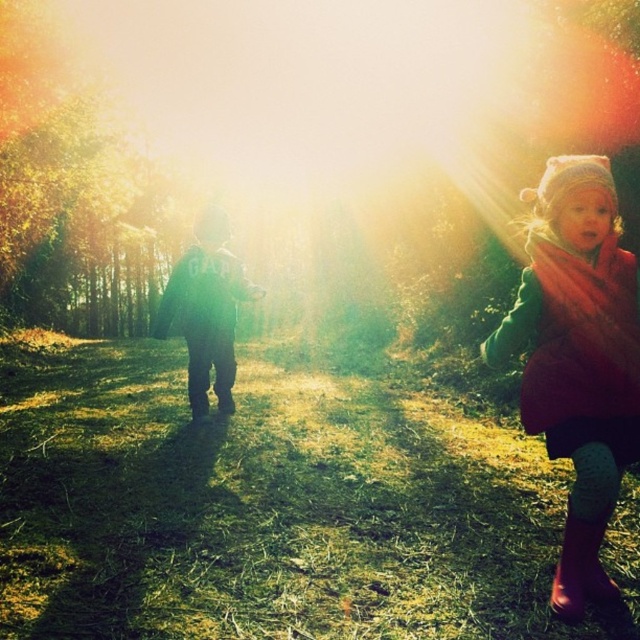
Can you confirm if knitted woolen hat at upper right is thinner than rubber boots at lower right?

No.

You are a GUI agent. You are given a task and a screenshot of the screen. Output one action in this format:
    pyautogui.click(x=<x>, y=<y>)
    Task: Click on the knitted woolen hat at upper right
    The width and height of the screenshot is (640, 640).
    Given the screenshot: What is the action you would take?
    pyautogui.click(x=577, y=356)

The width and height of the screenshot is (640, 640). What are the coordinates of `knitted woolen hat at upper right` in the screenshot? It's located at (577, 356).

Where is `knitted woolen hat at upper right`? The image size is (640, 640). knitted woolen hat at upper right is located at coordinates (577, 356).